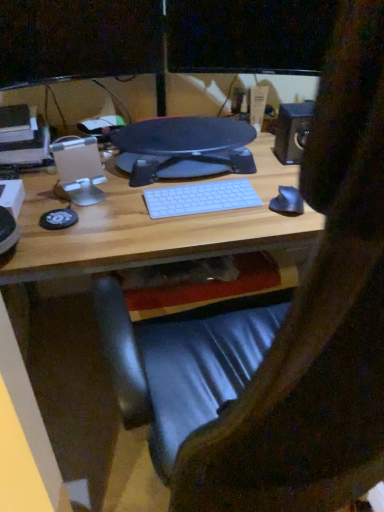
This screenshot has height=512, width=384. What do you see at coordinates (187, 145) in the screenshot? I see `glossy black monitor at center` at bounding box center [187, 145].

Locate an element on the screen. metallic black speaker at upper right is located at coordinates tap(292, 131).

Describe the element at coordinates (249, 35) in the screenshot. I see `matte black monitor at upper center, which is the 2th computer monitor from left to right` at that location.

The height and width of the screenshot is (512, 384). Describe the element at coordinates (200, 198) in the screenshot. I see `white matte keyboard at center` at that location.

Locate an element on the screen. This screenshot has height=512, width=384. matte black monitor at upper center, the 1th computer monitor when ordered from left to right is located at coordinates (76, 39).

Where is `glossy black monitor at center`? The width and height of the screenshot is (384, 512). glossy black monitor at center is located at coordinates (187, 145).

Which is more to the left, metallic black speaker at upper right or wooden desk at center?

From the viewer's perspective, wooden desk at center appears more on the left side.

Is metallic black speaker at upper right located outside wooden desk at center?

Yes, metallic black speaker at upper right is located beyond the bounds of wooden desk at center.

Is metallic black speaker at upper right facing towards wooden desk at center?

No, metallic black speaker at upper right is not aimed at wooden desk at center.

From a real-world perspective, between metallic black speaker at upper right and wooden desk at center, who is vertically higher?

metallic black speaker at upper right.

Is wooden desk at center beside glossy black monitor at center?

They are not placed beside each other.

Considering the relative sizes of wooden desk at center and glossy black monitor at center in the image provided, is wooden desk at center taller than glossy black monitor at center?

Indeed, wooden desk at center has a greater height compared to glossy black monitor at center.

Considering the sizes of objects wooden desk at center and glossy black monitor at center in the image provided, who is thinner, wooden desk at center or glossy black monitor at center?

glossy black monitor at center.

Considering the sizes of objects wooden desk at center and glossy black monitor at center in the image provided, who is bigger, wooden desk at center or glossy black monitor at center?

wooden desk at center is bigger.

Who is more distant, wooden desk at center or matte black monitor at upper center, which appears as the 2th computer monitor when viewed from the right?

matte black monitor at upper center, which appears as the 2th computer monitor when viewed from the right, is further from the camera.

Is wooden desk at center turned away from matte black monitor at upper center, which appears as the 2th computer monitor when viewed from the right?

No.

Considering the relative positions of wooden desk at center and matte black monitor at upper center, which appears as the 2th computer monitor when viewed from the right, in the image provided, is wooden desk at center to the right of matte black monitor at upper center, which appears as the 2th computer monitor when viewed from the right, from the viewer's perspective?

Yes.

From a real-world perspective, is wooden desk at center on matte black monitor at upper center, the 1th computer monitor when ordered from left to right?

Incorrect, from a real-world perspective, wooden desk at center is lower than matte black monitor at upper center, the 1th computer monitor when ordered from left to right.

From a real-world perspective, which is physically above, matte black monitor at upper center, which appears as the 2th computer monitor when viewed from the right, or white matte keyboard at center?

matte black monitor at upper center, which appears as the 2th computer monitor when viewed from the right, is physically above.

Is matte black monitor at upper center, the 1th computer monitor when ordered from left to right, to the right of white matte keyboard at center from the viewer's perspective?

In fact, matte black monitor at upper center, the 1th computer monitor when ordered from left to right, is to the left of white matte keyboard at center.

Is point (104, 55) more distant than point (213, 191)?

Yes, it is.

Between matte black monitor at upper center, which appears as the 2th computer monitor when viewed from the right, and white matte keyboard at center, which one has smaller width?

Thinner between the two is matte black monitor at upper center, which appears as the 2th computer monitor when viewed from the right.

Is matte black monitor at upper center, which is counted as the 1th computer monitor, starting from the right, positioned in front of metallic black speaker at upper right?

Yes, it is in front of metallic black speaker at upper right.

From a real-world perspective, who is located higher, matte black monitor at upper center, which is the 2th computer monitor from left to right, or metallic black speaker at upper right?

matte black monitor at upper center, which is the 2th computer monitor from left to right, is physically above.

Are matte black monitor at upper center, which is counted as the 1th computer monitor, starting from the right, and metallic black speaker at upper right far apart?

No, matte black monitor at upper center, which is counted as the 1th computer monitor, starting from the right, is in close proximity to metallic black speaker at upper right.

Considering the sizes of objects matte black monitor at upper center, which is the 2th computer monitor from left to right, and metallic black speaker at upper right in the image provided, who is taller, matte black monitor at upper center, which is the 2th computer monitor from left to right, or metallic black speaker at upper right?

With more height is matte black monitor at upper center, which is the 2th computer monitor from left to right.

From a real-world perspective, is matte black monitor at upper center, which is the 2th computer monitor from left to right, on top of white matte keyboard at center?

Yes, from a real-world perspective, matte black monitor at upper center, which is the 2th computer monitor from left to right, is over white matte keyboard at center

Is matte black monitor at upper center, which is the 2th computer monitor from left to right, oriented away from white matte keyboard at center?

No, matte black monitor at upper center, which is the 2th computer monitor from left to right, is not facing the opposite direction of white matte keyboard at center.

From the image's perspective, which one is positioned lower, matte black monitor at upper center, which is the 2th computer monitor from left to right, or white matte keyboard at center?

white matte keyboard at center.

Considering the positions of objects matte black monitor at upper center, which appears as the 2th computer monitor when viewed from the right, and matte black monitor at upper center, which is the 2th computer monitor from left to right, in the image provided, who is more to the right, matte black monitor at upper center, which appears as the 2th computer monitor when viewed from the right, or matte black monitor at upper center, which is the 2th computer monitor from left to right,?

matte black monitor at upper center, which is the 2th computer monitor from left to right.

The image size is (384, 512). I want to click on computer monitor that is on the right side of matte black monitor at upper center, which appears as the 2th computer monitor when viewed from the right, so 249,35.

Which of these two, matte black monitor at upper center, which appears as the 2th computer monitor when viewed from the right, or matte black monitor at upper center, which is counted as the 1th computer monitor, starting from the right, stands shorter?

matte black monitor at upper center, which is counted as the 1th computer monitor, starting from the right.

From the image's perspective, which is above, matte black monitor at upper center, which appears as the 2th computer monitor when viewed from the right, or matte black monitor at upper center, which is the 2th computer monitor from left to right?

matte black monitor at upper center, which is the 2th computer monitor from left to right, from the image's perspective.

Identify the location of speaker on the right of wooden desk at center. The height and width of the screenshot is (512, 384). (292, 131).

The image size is (384, 512). I want to click on desktop on the left side of wooden desk at center, so coord(187,145).

When comparing their distances from matte black monitor at upper center, which is counted as the 1th computer monitor, starting from the right, does metallic black speaker at upper right or glossy black monitor at center seem further?

The object further to matte black monitor at upper center, which is counted as the 1th computer monitor, starting from the right, is glossy black monitor at center.

Looking at the image, which one is located further to matte black monitor at upper center, the 1th computer monitor when ordered from left to right, glossy black monitor at center or white matte keyboard at center?

white matte keyboard at center.

From the image, which object appears to be nearer to glossy black monitor at center, wooden desk at center or metallic black speaker at upper right?

wooden desk at center is positioned closer to the anchor glossy black monitor at center.

Which object lies further to the anchor point glossy black monitor at center, matte black monitor at upper center, which is the 2th computer monitor from left to right, or matte black monitor at upper center, which appears as the 2th computer monitor when viewed from the right?

matte black monitor at upper center, which appears as the 2th computer monitor when viewed from the right.

Based on their spatial positions, is white matte keyboard at center or metallic black speaker at upper right closer to matte black monitor at upper center, which appears as the 2th computer monitor when viewed from the right?

white matte keyboard at center is closer to matte black monitor at upper center, which appears as the 2th computer monitor when viewed from the right.

In the scene shown: Estimate the real-world distances between objects in this image. Which object is closer to glossy black monitor at center, metallic black speaker at upper right or white matte keyboard at center?

white matte keyboard at center.

Based on their spatial positions, is wooden desk at center or matte black monitor at upper center, which is counted as the 1th computer monitor, starting from the right, closer to white matte keyboard at center?

wooden desk at center is closer to white matte keyboard at center.

Considering their positions, is glossy black monitor at center positioned closer to white matte keyboard at center than matte black monitor at upper center, which is the 2th computer monitor from left to right?

glossy black monitor at center lies closer to white matte keyboard at center than the other object.

Find the location of a particular element. This screenshot has width=384, height=512. desktop between matte black monitor at upper center, the 1th computer monitor when ordered from left to right, and white matte keyboard at center from top to bottom is located at coordinates (187, 145).

Locate an element on the screen. Image resolution: width=384 pixels, height=512 pixels. desktop between matte black monitor at upper center, the 1th computer monitor when ordered from left to right, and wooden desk at center in the up-down direction is located at coordinates (187, 145).

Find the location of a particular element. The image size is (384, 512). computer monitor between matte black monitor at upper center, which appears as the 2th computer monitor when viewed from the right, and metallic black speaker at upper right from left to right is located at coordinates point(249,35).

In order to click on desktop located between matte black monitor at upper center, the 1th computer monitor when ordered from left to right, and metallic black speaker at upper right in the left-right direction in this screenshot , I will do (x=187, y=145).